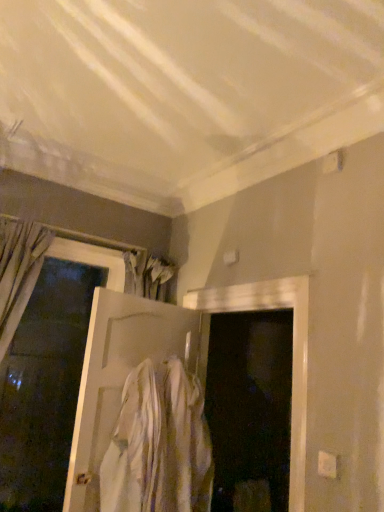
Question: From a real-world perspective, is white cotton shirt at center positioned above or below white matte door at center, positioned as the second door in left-to-right order?

Choices:
 (A) above
 (B) below

Answer: (B)

Question: From their relative heights in the image, would you say white cotton shirt at center is taller or shorter than white matte door at center, positioned as the second door in left-to-right order?

Choices:
 (A) tall
 (B) short

Answer: (B)

Question: Which object is the closest to the white matte door at center, the first door when ordered from right to left?

Choices:
 (A) white matte door at left, which ranks as the first door in left-to-right order
 (B) white cotton shirt at center

Answer: (B)

Question: Which of these objects is positioned closest to the white cotton shirt at center?

Choices:
 (A) white matte door at left, which ranks as the first door in left-to-right order
 (B) white matte door at center, positioned as the second door in left-to-right order

Answer: (B)